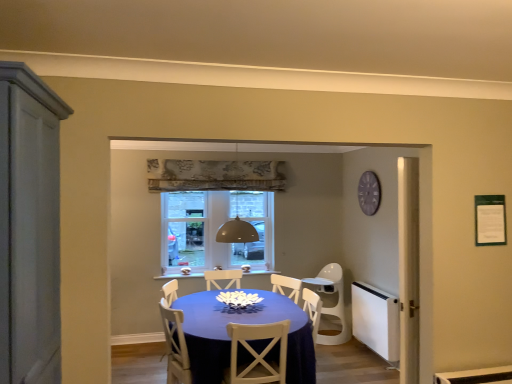
Find the location of a particular element. The image size is (512, 384). clear glass window at center is located at coordinates (183, 229).

This screenshot has height=384, width=512. Describe the element at coordinates (331, 301) in the screenshot. I see `white plastic chair at center, positioned as the first chair in back-to-front order` at that location.

What is the approximate width of white plastic chair at center, the second chair in the front-to-back sequence?

The width of white plastic chair at center, the second chair in the front-to-back sequence, is 21.99 inches.

Locate an element on the screen. Image resolution: width=512 pixels, height=384 pixels. matte blue table at center is located at coordinates (242, 323).

Locate an element on the screen. This screenshot has height=384, width=512. clear glass window at center is located at coordinates (183, 229).

Which of these two, white matte radiator at right or purple wooden clock at upper right, stands shorter?

purple wooden clock at upper right is shorter.

Which of these two, white matte radiator at right or purple wooden clock at upper right, is smaller?

Smaller between the two is purple wooden clock at upper right.

Is white matte radiator at right oriented away from purple wooden clock at upper right?

That's not correct — white matte radiator at right is not looking away from purple wooden clock at upper right.

Considering the positions of objects purple wooden clock at upper right and white matte door at left in the image provided, who is in front, purple wooden clock at upper right or white matte door at left?

Positioned in front is white matte door at left.

Considering the relative sizes of purple wooden clock at upper right and white matte door at left in the image provided, is purple wooden clock at upper right smaller than white matte door at left?

Yes, purple wooden clock at upper right is smaller than white matte door at left.

Would you say purple wooden clock at upper right is a long distance from white matte door at left?

Absolutely, purple wooden clock at upper right is distant from white matte door at left.

Is white matte radiator at right to the right of matte blue table at center from the viewer's perspective?

Indeed, white matte radiator at right is positioned on the right side of matte blue table at center.

From the image's perspective, would you say white matte radiator at right is shown under matte blue table at center?

Correct, white matte radiator at right appears lower than matte blue table at center in the image.

From a real-world perspective, is white matte radiator at right physically located above or below matte blue table at center?

In terms of real-world spatial position, white matte radiator at right is below matte blue table at center.

Is white matte door at left outside of white plastic chair at center, the second chair in the front-to-back sequence?

white matte door at left lies outside white plastic chair at center, the second chair in the front-to-back sequence,'s area.

From the image's perspective, is white matte door at left on white plastic chair at center, placed as the second chair when sorted from left to right?

Yes, from the image's perspective, white matte door at left is on top of white plastic chair at center, placed as the second chair when sorted from left to right.

The image size is (512, 384). Find the location of `the 2nd chair positioned below the white matte door at left (from the image's perspective)`. the 2nd chair positioned below the white matte door at left (from the image's perspective) is located at coordinates (331, 301).

Is white wood chair at center, which is the second chair from back to front, turned away from white plastic chair at center, positioned as the first chair in back-to-front order?

No.

Is white wood chair at center, positioned as the 1th chair in front-to-back order, to the left of white plastic chair at center, acting as the 1th chair starting from the right, from the viewer's perspective?

Yes, white wood chair at center, positioned as the 1th chair in front-to-back order, is to the left of white plastic chair at center, acting as the 1th chair starting from the right.

How different are the orientations of white wood chair at center, the second chair from the right, and white plastic chair at center, placed as the second chair when sorted from left to right, in degrees?

The angle between the facing direction of white wood chair at center, the second chair from the right, and the facing direction of white plastic chair at center, placed as the second chair when sorted from left to right, is 175 degrees.

Is white plastic chair at center, the second chair in the front-to-back sequence, completely or partially outside of matte blue table at center?

That's correct, white plastic chair at center, the second chair in the front-to-back sequence, is outside of matte blue table at center.

Considering the relative sizes of white plastic chair at center, the second chair in the front-to-back sequence, and matte blue table at center in the image provided, is white plastic chair at center, the second chair in the front-to-back sequence, taller than matte blue table at center?

Correct, white plastic chair at center, the second chair in the front-to-back sequence, is much taller as matte blue table at center.

Measure the distance between white plastic chair at center, placed as the second chair when sorted from left to right, and matte blue table at center.

white plastic chair at center, placed as the second chair when sorted from left to right, and matte blue table at center are 1.63 meters apart from each other.

Locate an element on the screen. kitchen & dining room table on the left of white plastic chair at center, positioned as the first chair in back-to-front order is located at coordinates (242, 323).

In terms of width, does clear glass window at center look wider or thinner when compared to matte blue table at center?

Considering their sizes, clear glass window at center looks slimmer than matte blue table at center.

From the picture: Is clear glass window at center to the left or to the right of matte blue table at center in the image?

From the image, it's evident that clear glass window at center is to the left of matte blue table at center.

Is clear glass window at center positioned far away from matte blue table at center?

Yes.

Locate an element on the screen. The height and width of the screenshot is (384, 512). clock to the left of white matte radiator at right is located at coordinates (369, 193).

You are a GUI agent. You are given a task and a screenshot of the screen. Output one action in this format:
    pyautogui.click(x=<x>, y=<y>)
    Task: Click on the cabinetry in front of the purple wooden clock at upper right
    
    Given the screenshot: What is the action you would take?
    pyautogui.click(x=29, y=227)

Estimate the real-world distances between objects in this image. Which object is further from matte blue table at center, white wood chair at center, the second chair from the right, or white plastic chair at center, positioned as the first chair in back-to-front order?

white plastic chair at center, positioned as the first chair in back-to-front order, lies further to matte blue table at center than the other object.

In the scene shown: Considering their positions, is white wood chair at center, the second chair from the right, positioned closer to white plastic chair at center, positioned as the first chair in back-to-front order, than white matte door at left?

A: The object closer to white plastic chair at center, positioned as the first chair in back-to-front order, is white wood chair at center, the second chair from the right.

From the image, which object appears to be nearer to purple wooden clock at upper right, white matte door at left or matte blue table at center?

The object closer to purple wooden clock at upper right is matte blue table at center.

Looking at the image, which one is located closer to white wood chair at center, positioned as the 1th chair in front-to-back order, white plastic chair at center, positioned as the first chair in back-to-front order, or white matte door at left?

white matte door at left lies closer to white wood chair at center, positioned as the 1th chair in front-to-back order, than the other object.

Looking at the image, which one is located closer to matte blue table at center, white matte radiator at right or white plastic chair at center, the second chair in the front-to-back sequence?

white matte radiator at right is positioned closer to the anchor matte blue table at center.

Estimate the real-world distances between objects in this image. Which object is closer to matte blue table at center, purple wooden clock at upper right or white wood chair at center, the second chair from the right?

Among the two, white wood chair at center, the second chair from the right, is located nearer to matte blue table at center.

Considering their positions, is white wood chair at center, positioned as the 1th chair in front-to-back order, positioned closer to purple wooden clock at upper right than matte blue table at center?

Among the two, matte blue table at center is located nearer to purple wooden clock at upper right.

From the image, which object appears to be nearer to matte blue table at center, clear glass window at center or white matte radiator at right?

white matte radiator at right.

Image resolution: width=512 pixels, height=384 pixels. In order to click on clock positioned between white matte door at left and white plastic chair at center, positioned as the first chair in back-to-front order, from near to far in this screenshot , I will do `click(369, 193)`.

Locate an element on the screen. The height and width of the screenshot is (384, 512). kitchen & dining room table located between white matte door at left and white matte radiator at right in the depth direction is located at coordinates (242, 323).

At what (x,y) coordinates should I click in order to perform the action: click on appliance located between white matte door at left and clear glass window at center in the depth direction. Please return your answer as a coordinate pair (x, y). Looking at the image, I should click on (376, 320).

Find the location of a particular element. This screenshot has width=512, height=384. clock located between white matte door at left and clear glass window at center in the depth direction is located at coordinates (369, 193).